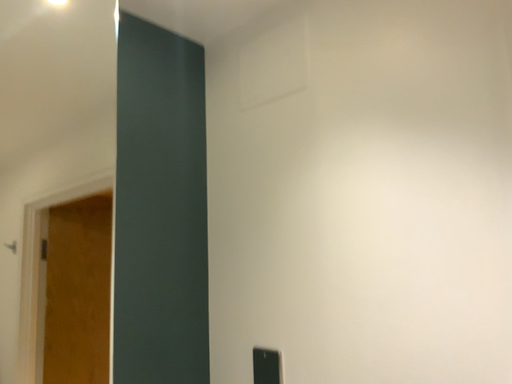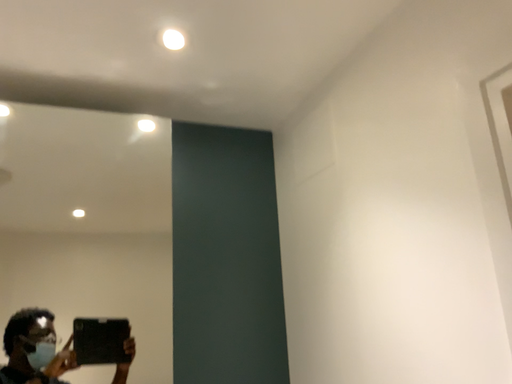
Question: How did the camera likely rotate when shooting the video?

Choices:
 (A) rotated left
 (B) rotated right

Answer: (A)